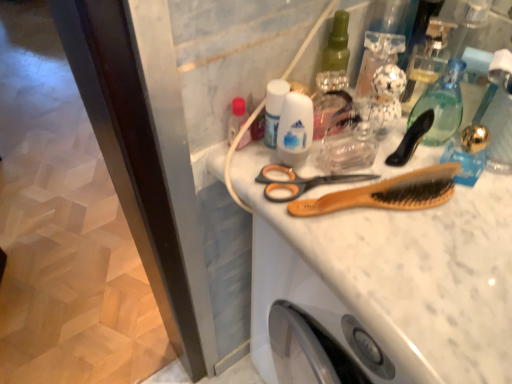
Locate an element on the screen. empty space that is to the right of white glossy mouthwash at center, which appears as the 1th mouthwash when viewed from the left is located at coordinates (391, 174).